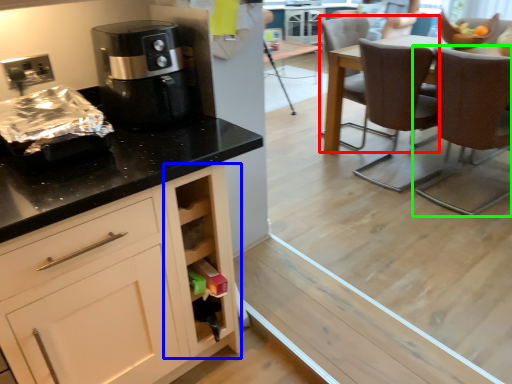
Question: Which object is the farthest from chair (highlighted by a red box)? Choose among these: cabinetry (highlighted by a blue box) or chair (highlighted by a green box).

Choices:
 (A) cabinetry
 (B) chair

Answer: (A)